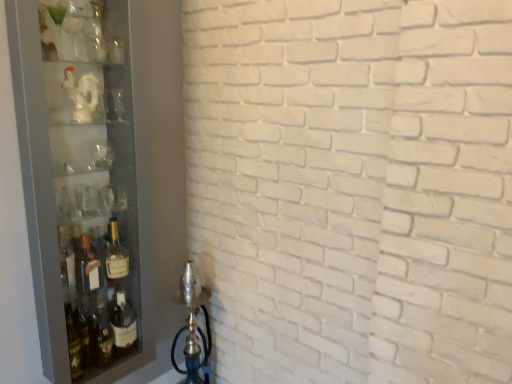
Question: Does white glossy statue at upper left have a greater width compared to matte glass bottle at left?

Choices:
 (A) yes
 (B) no

Answer: (B)

Question: Does white glossy statue at upper left have a lesser width compared to matte glass bottle at left?

Choices:
 (A) yes
 (B) no

Answer: (A)

Question: Does white glossy statue at upper left have a larger size compared to matte glass bottle at left?

Choices:
 (A) no
 (B) yes

Answer: (A)

Question: Considering the relative sizes of white glossy statue at upper left and matte glass bottle at left in the image provided, is white glossy statue at upper left shorter than matte glass bottle at left?

Choices:
 (A) no
 (B) yes

Answer: (B)

Question: From a real-world perspective, does white glossy statue at upper left stand above matte glass bottle at left?

Choices:
 (A) yes
 (B) no

Answer: (A)

Question: Considering the relative sizes of white glossy statue at upper left and matte glass bottle at left in the image provided, is white glossy statue at upper left taller than matte glass bottle at left?

Choices:
 (A) yes
 (B) no

Answer: (B)

Question: Considering the relative positions of white glossy statue at upper left and transparent glass cabinet at left in the image provided, is white glossy statue at upper left behind transparent glass cabinet at left?

Choices:
 (A) yes
 (B) no

Answer: (A)

Question: Is white glossy statue at upper left to the right of transparent glass cabinet at left from the viewer's perspective?

Choices:
 (A) yes
 (B) no

Answer: (B)

Question: From the image's perspective, would you say white glossy statue at upper left is positioned over transparent glass cabinet at left?

Choices:
 (A) yes
 (B) no

Answer: (A)

Question: Can you confirm if white glossy statue at upper left is wider than transparent glass cabinet at left?

Choices:
 (A) no
 (B) yes

Answer: (A)

Question: Is white glossy statue at upper left facing towards transparent glass cabinet at left?

Choices:
 (A) no
 (B) yes

Answer: (B)

Question: Considering the relative sizes of white glossy statue at upper left and transparent glass cabinet at left in the image provided, is white glossy statue at upper left taller than transparent glass cabinet at left?

Choices:
 (A) no
 (B) yes

Answer: (A)

Question: Can you confirm if matte glass bottle at left is wider than transparent glass cabinet at left?

Choices:
 (A) yes
 (B) no

Answer: (B)